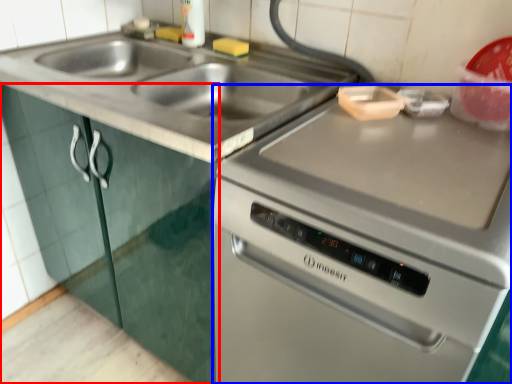
Question: Among these objects, which one is farthest to the camera, cabinetry (highlighted by a red box) or oven (highlighted by a blue box)?

Choices:
 (A) cabinetry
 (B) oven

Answer: (A)